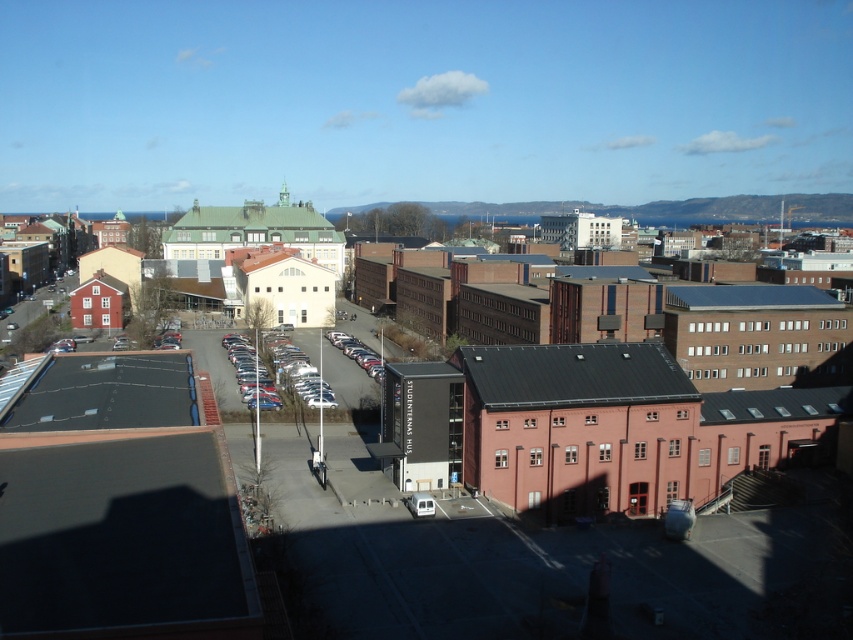
Is brick building at center further to camera compared to metallic silver car at center-left?

No, it is not.

This screenshot has height=640, width=853. I want to click on brick building at center, so click(643, 397).

Can you confirm if brick building at center is thinner than metallic silver car at center?

No.

Between point (538, 362) and point (375, 355), which one is positioned in front?

Point (538, 362)

The height and width of the screenshot is (640, 853). Identify the location of brick building at center. (643, 397).

Between metallic silver car at center-left and metallic silver car at center, which one has less height?

With less height is metallic silver car at center.

Who is more forward, (259,381) or (378,374)?

Point (259,381) is in front.

The height and width of the screenshot is (640, 853). What are the coordinates of `metallic silver car at center-left` in the screenshot? It's located at (296, 371).